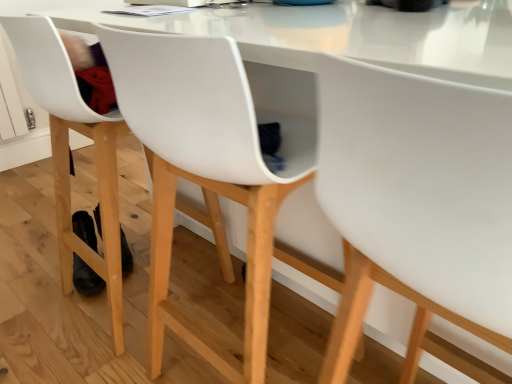
Question: In terms of width, does white matte chair at center, which is the second chair in left-to-right order, look wider or thinner when compared to white matte chair at center, which is counted as the first chair, starting from the left?

Choices:
 (A) thin
 (B) wide

Answer: (A)

Question: Is white matte chair at center, which is the second chair in left-to-right order, in front of or behind white matte chair at center, which is counted as the first chair, starting from the left, in the image?

Choices:
 (A) front
 (B) behind

Answer: (A)

Question: Would you say white matte chair at center, which is the second chair in left-to-right order, is inside or outside white matte chair at center, which is counted as the first chair, starting from the left?

Choices:
 (A) outside
 (B) inside

Answer: (A)

Question: From the image's perspective, is white matte chair at center, placed as the second chair when sorted from right to left, positioned above or below white matte chair at center, which ranks as the first chair in right-to-left order?

Choices:
 (A) above
 (B) below

Answer: (A)

Question: From a real-world perspective, is white matte chair at center, which is counted as the first chair, starting from the left, above or below white matte chair at center, which is the second chair in left-to-right order?

Choices:
 (A) above
 (B) below

Answer: (B)

Question: Which is correct: white matte chair at center, which is counted as the first chair, starting from the left, is inside white matte chair at center, which ranks as the first chair in right-to-left order, or outside of it?

Choices:
 (A) outside
 (B) inside

Answer: (A)

Question: Is white matte chair at center, which is counted as the first chair, starting from the left, in front of or behind white matte chair at center, which ranks as the first chair in right-to-left order, in the image?

Choices:
 (A) front
 (B) behind

Answer: (B)